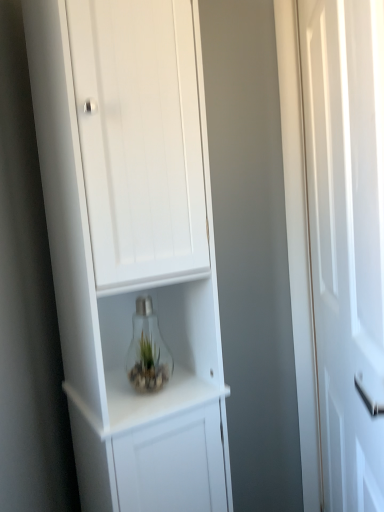
Question: Is clear glass bulb at center shorter than white glossy door at right?

Choices:
 (A) no
 (B) yes

Answer: (B)

Question: Can you confirm if clear glass bulb at center is smaller than white glossy door at right?

Choices:
 (A) no
 (B) yes

Answer: (B)

Question: Is clear glass bulb at center to the left of white glossy door at right from the viewer's perspective?

Choices:
 (A) no
 (B) yes

Answer: (B)

Question: Does clear glass bulb at center appear on the right side of white glossy door at right?

Choices:
 (A) no
 (B) yes

Answer: (A)

Question: From the image's perspective, is clear glass bulb at center above white glossy door at right?

Choices:
 (A) no
 (B) yes

Answer: (A)

Question: From their relative heights in the image, would you say clear glass bulb at center is taller or shorter than white matte cabinet at center?

Choices:
 (A) tall
 (B) short

Answer: (B)

Question: Would you say clear glass bulb at center is to the left or to the right of white matte cabinet at center in the picture?

Choices:
 (A) left
 (B) right

Answer: (B)

Question: Considering their positions, is clear glass bulb at center located in front of or behind white matte cabinet at center?

Choices:
 (A) front
 (B) behind

Answer: (B)

Question: Based on their sizes in the image, would you say clear glass bulb at center is bigger or smaller than white matte cabinet at center?

Choices:
 (A) big
 (B) small

Answer: (B)

Question: In terms of size, does white matte cabinet at center appear bigger or smaller than clear glass bulb at center?

Choices:
 (A) big
 (B) small

Answer: (A)

Question: Is white matte cabinet at center in front of or behind clear glass bulb at center in the image?

Choices:
 (A) behind
 (B) front

Answer: (B)

Question: From a real-world perspective, is white matte cabinet at center above or below clear glass bulb at center?

Choices:
 (A) above
 (B) below

Answer: (A)

Question: Considering the positions of white matte cabinet at center and clear glass bulb at center in the image, is white matte cabinet at center wider or thinner than clear glass bulb at center?

Choices:
 (A) thin
 (B) wide

Answer: (B)

Question: Looking at their shapes, would you say clear glass bulb at center is wider or thinner than white glossy door at right?

Choices:
 (A) thin
 (B) wide

Answer: (A)

Question: Is clear glass bulb at center to the left or to the right of white glossy door at right in the image?

Choices:
 (A) right
 (B) left

Answer: (B)